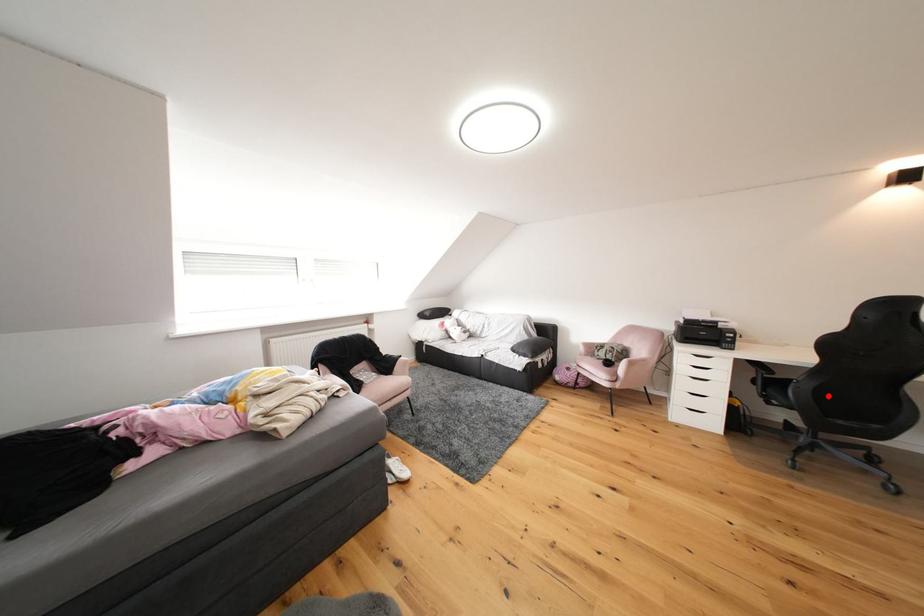
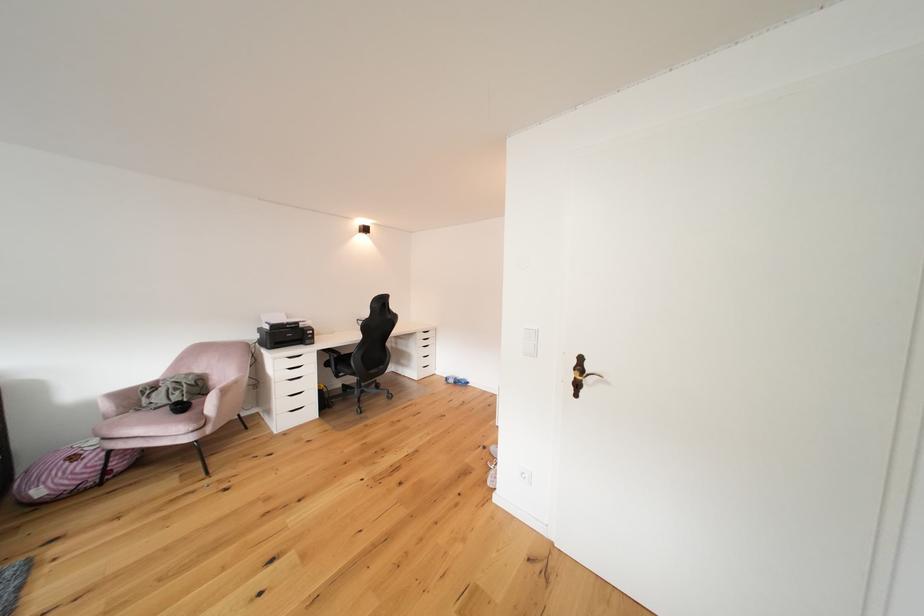
Locate, in the second image, the point that corresponds to the highlighted location in the first image.

(372, 362)